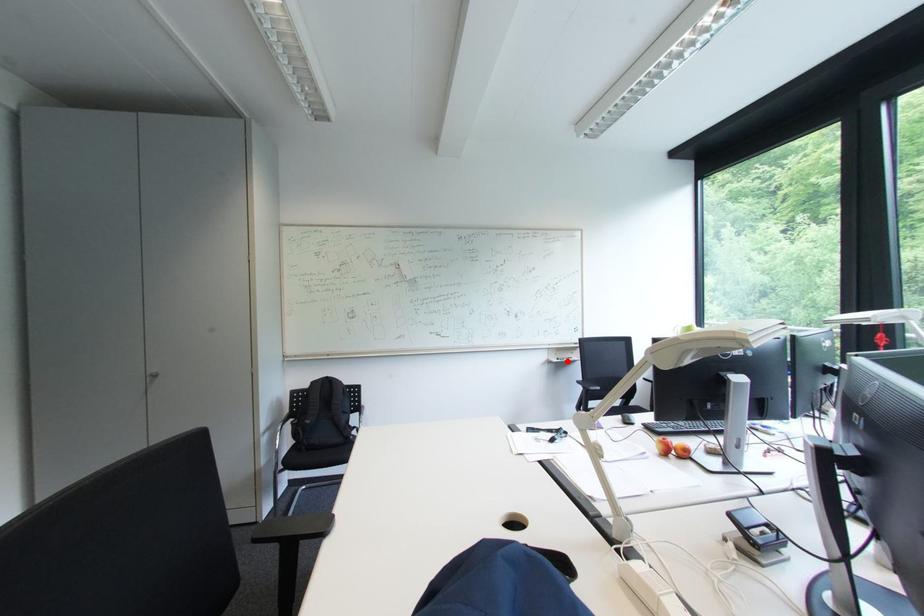
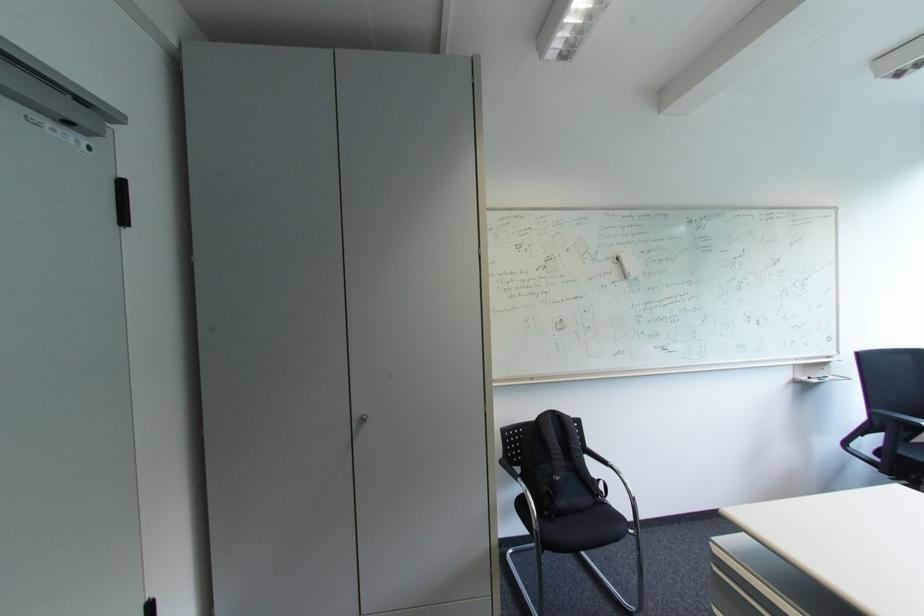
Where in the second image is the point corresponding to the highlighted location from the first image?

(819, 379)